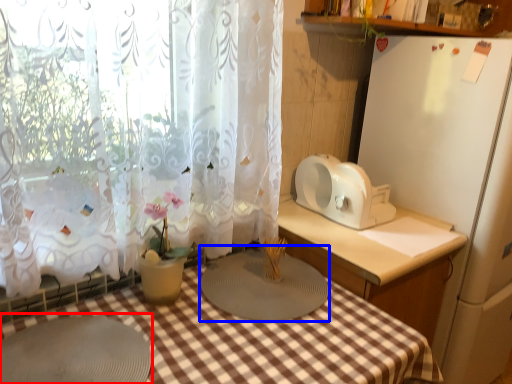
Question: Among these objects, which one is nearest to the camera, round table (highlighted by a red box) or appliance (highlighted by a blue box)?

Choices:
 (A) round table
 (B) appliance

Answer: (A)